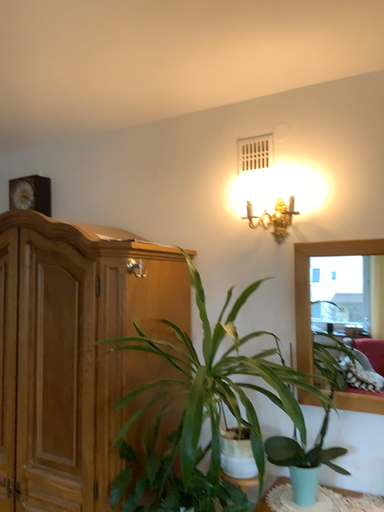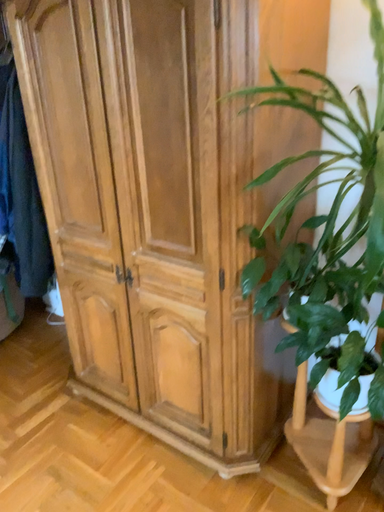
Question: How did the camera likely rotate when shooting the video?

Choices:
 (A) rotated left
 (B) rotated right

Answer: (A)